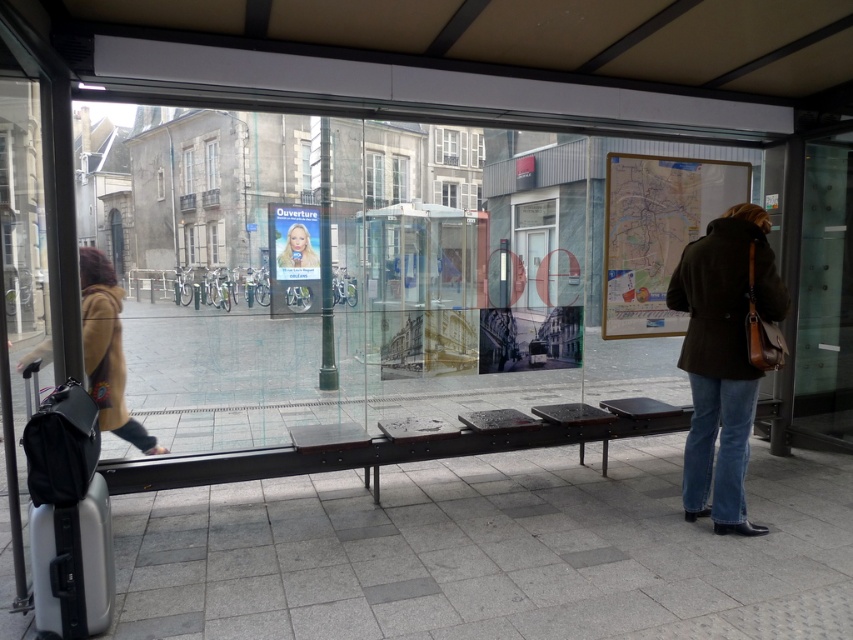
Which is behind, point (395, 196) or point (192, 180)?

The point (395, 196) is behind.

Is transparent glass window at center bigger than white glass window at upper left?

Indeed, transparent glass window at center has a larger size compared to white glass window at upper left.

You are a GUI agent. You are given a task and a screenshot of the screen. Output one action in this format:
    pyautogui.click(x=<x>, y=<y>)
    Task: Click on the transparent glass window at center
    The height and width of the screenshot is (640, 853).
    Given the screenshot: What is the action you would take?
    pyautogui.click(x=399, y=179)

Can you confirm if silver metallic suitcase at lower left is bigger than clear glass window at upper center?

Actually, silver metallic suitcase at lower left might be smaller than clear glass window at upper center.

Looking at this image, does silver metallic suitcase at lower left have a greater height compared to clear glass window at upper center?

No, silver metallic suitcase at lower left is not taller than clear glass window at upper center.

Describe the element at coordinates (73, 564) in the screenshot. The width and height of the screenshot is (853, 640). I see `silver metallic suitcase at lower left` at that location.

Identify the location of silver metallic suitcase at lower left. The width and height of the screenshot is (853, 640). (73, 564).

Is brown leather coat at lower right below transparent glass door at right?

Indeed, brown leather coat at lower right is positioned under transparent glass door at right.

Is brown leather coat at lower right taller than transparent glass door at right?

Incorrect, brown leather coat at lower right's height is not larger of transparent glass door at right's.

Does point (738, 296) come behind point (815, 166)?

No, it is not.

Find the location of a particular element. The width and height of the screenshot is (853, 640). brown leather coat at lower right is located at coordinates (722, 358).